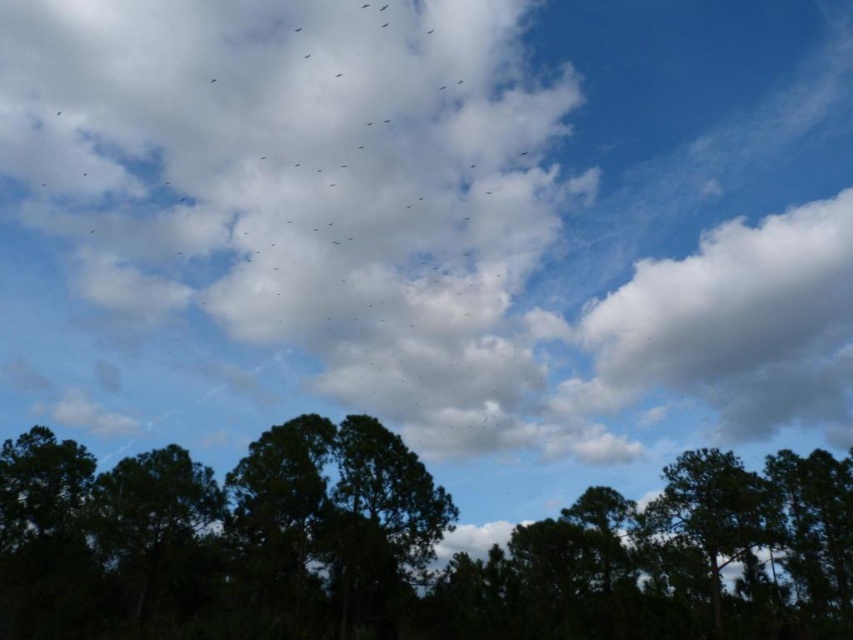
You are a bird soaring high above the trees. You see the white fluffy cloud at upper center and the dark green foliage at center. Which object is located above the other?

The white fluffy cloud at upper center is positioned over dark green foliage at center, meaning it is above the foliage.

You are an astronomer analyzing the image. You need to determine the position of the white fluffy cloud at upper center. What are its coordinates?

The white fluffy cloud at upper center is located at coordinates (x=439, y=212).

You are a photographer standing in a field, and you want to capture the white fluffy cloud at upper center in your photo. The camera you are using has a maximum focus range of 80 meters. Will the cloud be in focus?

The white fluffy cloud at upper center is 80.96 meters from the camera, which exceeds the maximum focus range of 80 meters. Therefore, the cloud will not be in focus.